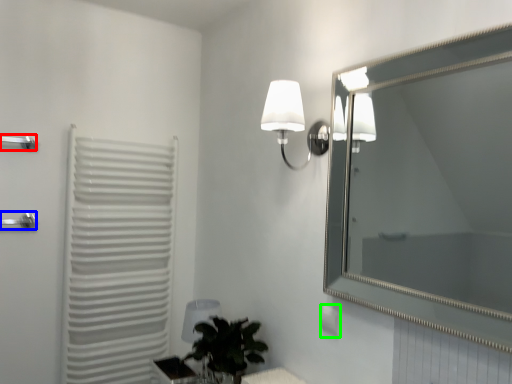
Question: Which is farther away from towel bar (highlighted by a red box)? shower (highlighted by a blue box) or electric outlet (highlighted by a green box)?

Choices:
 (A) shower
 (B) electric outlet

Answer: (B)